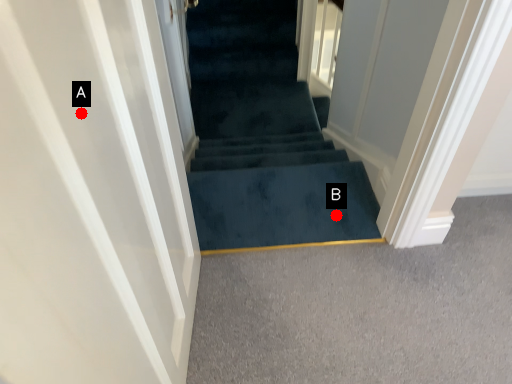
Question: Two points are circled on the image, labeled by A and B beside each circle. Which point is closer to the camera?

Choices:
 (A) A is closer
 (B) B is closer

Answer: (A)